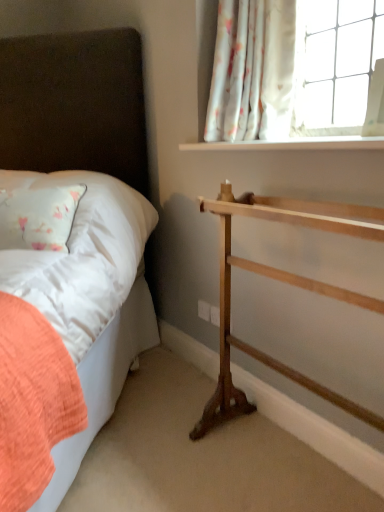
Question: Is natural wood towel rack at right taller or shorter than white floral fabric at upper right?

Choices:
 (A) tall
 (B) short

Answer: (A)

Question: Would you say natural wood towel rack at right is inside or outside white floral fabric at upper right?

Choices:
 (A) outside
 (B) inside

Answer: (A)

Question: Considering the real-world distances, which object is closest to the matte white bed at left?

Choices:
 (A) white floral fabric at upper right
 (B) white smooth window sill at upper right
 (C) natural wood towel rack at right

Answer: (A)

Question: Considering the real-world distances, which object is farthest from the white smooth window sill at upper right?

Choices:
 (A) white floral fabric at upper right
 (B) matte white bed at left
 (C) natural wood towel rack at right

Answer: (B)